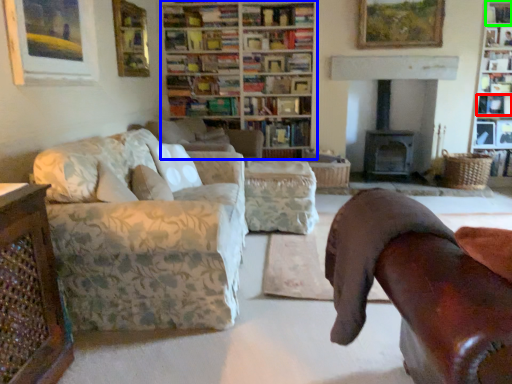
Question: Based on their relative distances, which object is farther from book (highlighted by a red box)? Choose from bookcase (highlighted by a blue box) and shelf (highlighted by a green box).

Choices:
 (A) bookcase
 (B) shelf

Answer: (A)